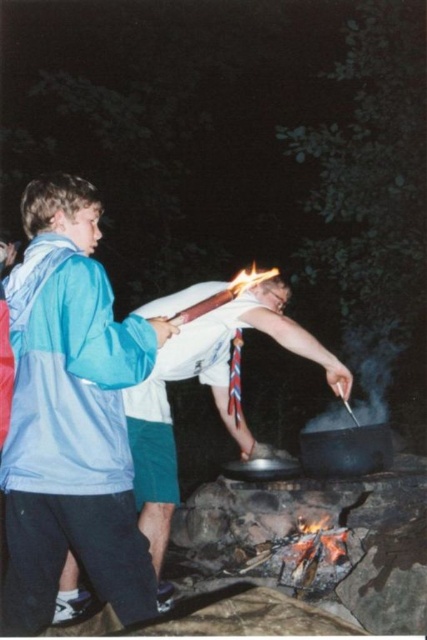
You are planning to buy a new jacket and want to ensure it matches your existing shirt. Given that you have the blue fabric jacket at left and the white fabric shirt at center, which one is narrower in width?

The blue fabric jacket at left is narrower in width than the white fabric shirt at center.

You are standing in the dark campfire scene and want to hand a marshmallow to the person wearing the white fabric shirt at center. Which direction should you move to reach them, considering the blue fabric jacket at left is blocking your path?

The blue fabric jacket at left is above the white fabric shirt at center, so you should move downward to reach the white fabric shirt at center while avoiding the obstruction from the blue fabric jacket at left.

You are standing in the dark campfire scene and want to hand a marshmallow to the taller person. Which person should you approach, the blue fabric jacket at left or the white fabric shirt at center?

The white fabric shirt at center is taller than the blue fabric jacket at left, so you should approach the white fabric shirt at center.